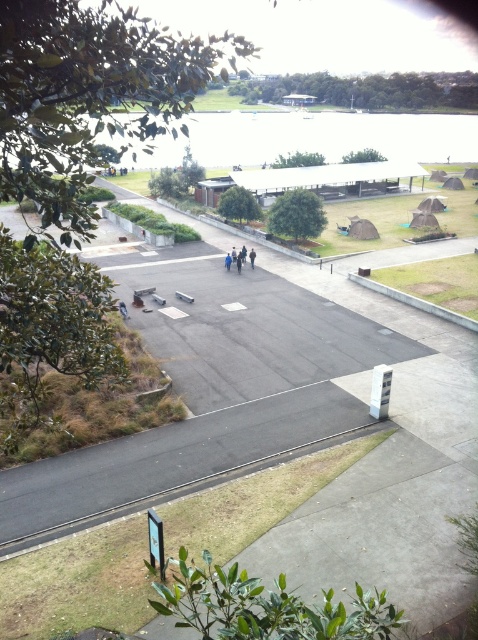
You are a hiker who wants to cross from the asphalt pavement at center to the clear water at upper center. Given that your hiking backpack can carry a maximum load of 10 kilograms, and you estimate that each meter traveled consumes 0.1 kilograms of your load capacity due to terrain difficulty, can you safely make the journey without exceeding your backpack capacity?

The distance between asphalt pavement at center and clear water at upper center is 77.66 meters. Traveling this distance would consume 7.766 kilograms of your load capacity, which is under the 10 kilogram limit. Therefore, you can safely make the journey.

You are standing on the balcony and want to determine if the clear water at upper center can accommodate the brown fabric person at center if they were to lie down on it. Based on their widths, is this possible?

The clear water at upper center is wider than the brown fabric person at center, so the person could lie down on it as the water area is sufficiently wide to accommodate their length.

You are standing on a balcony overlooking the scene. You see the asphalt pavement at center and the brown fabric person at center. Which object is lower in elevation?

The asphalt pavement at center is located below the brown fabric person at center, so the asphalt pavement at center is lower in elevation.